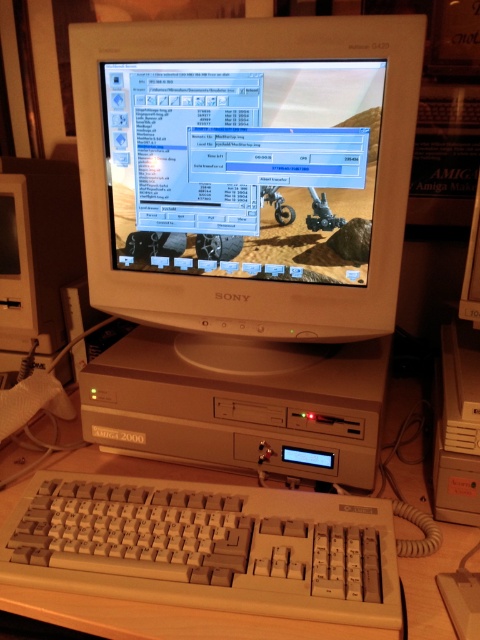
You are setting up a vintage computer desk and need to place the white plastic monitor at center and the white plastic keyboard at lower center. According to the image, which object is placed above the other?

The white plastic monitor at center is positioned over the white plastic keyboard at lower center, so the monitor is above the keyboard.

You are a technician trying to locate the white plastic monitor at center in the vintage computer setup. Based on the coordinates provided, can you confirm if the white plastic monitor at center is positioned at point (248, 176)?

Yes, according to the coordinates provided, the white plastic monitor at center is indeed located at point (248, 176).

You are navigating a tiny robot through a vintage computer setup. The robot starts at point A and needs to reach point B without passing through any objects. Given that point A is at point (277, 97) and point B is at point (230, 515), which direction should the robot move first to avoid obstacles?

The robot should move forward first because point (277, 97) is behind point (230, 515), so moving forward from point A towards point B would avoid obstacles.